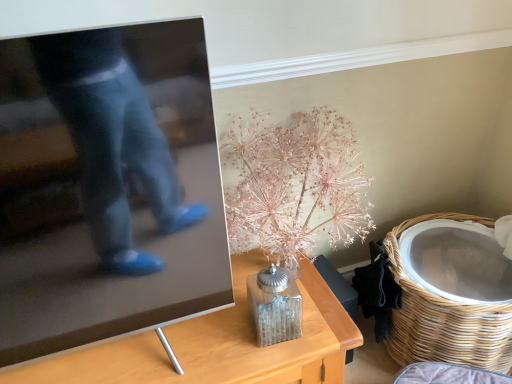
The height and width of the screenshot is (384, 512). Describe the element at coordinates (446, 318) in the screenshot. I see `woven wicker basket at lower right` at that location.

Where is `woven wicker basket at lower right`? woven wicker basket at lower right is located at coordinates (446, 318).

At what (x,y) coordinates should I click in order to perform the action: click on woven wicker basket at lower right. Please return your answer as a coordinate pair (x, y). Looking at the image, I should click on (446, 318).